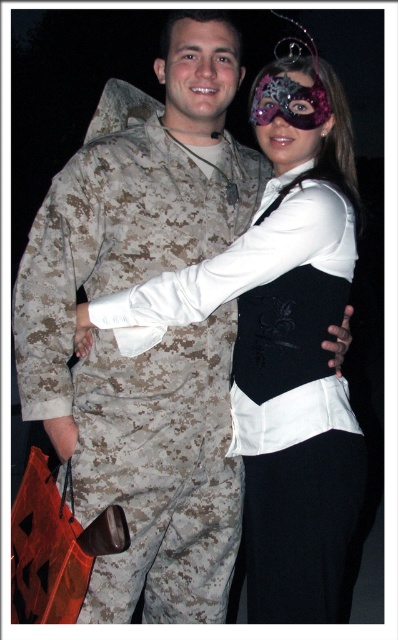
You are a photographer at the event and want to ensure both the matte camouflage uniform at center and the sparkly purple mask at center are clearly visible in the photo. Which one should you focus on first to ensure proper depth of field?

The matte camouflage uniform at center is in front of the sparkly purple mask at center, so you should focus on the matte camouflage uniform at center first to ensure both are in focus.

You are a photographer trying to adjust the lighting for a portrait of the two people in the image. You need to ensure that the matte camouflage uniform at center and the smooth skin face at center are both well lit. Which object should you focus the light on first to ensure proper exposure, considering their position relative to each other?

The matte camouflage uniform at center is below the smooth skin face at center. Since the face is higher up, you should focus the light on the smooth skin face at center first to ensure it receives adequate illumination before adjusting for the uniform below.